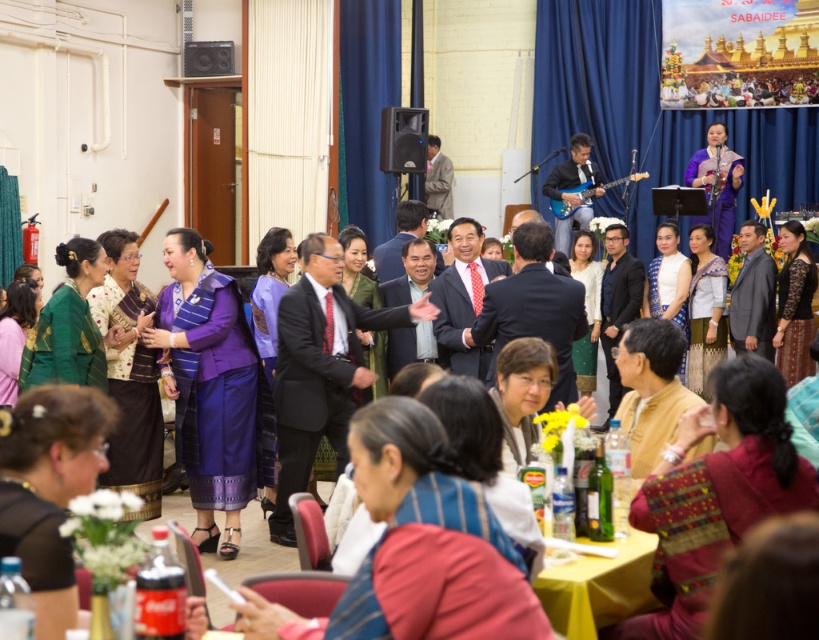
Is satin blue guitar at center below black plastic speaker at center?

Yes.

Is satin blue guitar at center in front of black plastic speaker at center?

That is False.

This screenshot has height=640, width=819. I want to click on satin blue guitar at center, so click(x=572, y=188).

Is matte purple dress at center closer to the viewer compared to embroidered silk dress at lower right?

Yes, it is.

Which of these two, matte purple dress at center or embroidered silk dress at lower right, stands shorter?

Standing shorter between the two is matte purple dress at center.

Locate an element on the screen. matte purple dress at center is located at coordinates (417, 545).

The height and width of the screenshot is (640, 819). Identify the location of matte purple dress at center. (417, 545).

Image resolution: width=819 pixels, height=640 pixels. Describe the element at coordinates (207, 387) in the screenshot. I see `purple satin dress at center` at that location.

Does purple satin dress at center have a greater height compared to yellow fabric table at lower center?

Yes.

Is point (197, 456) less distant than point (620, 586)?

No.

Image resolution: width=819 pixels, height=640 pixels. I want to click on purple satin dress at center, so click(x=207, y=387).